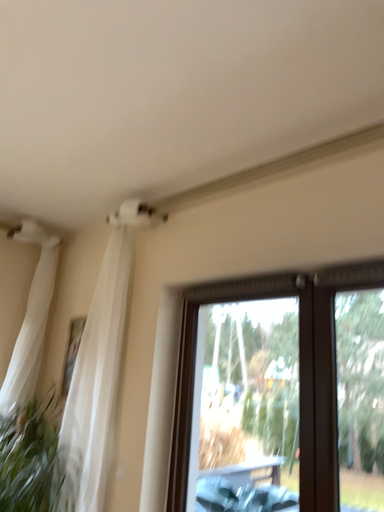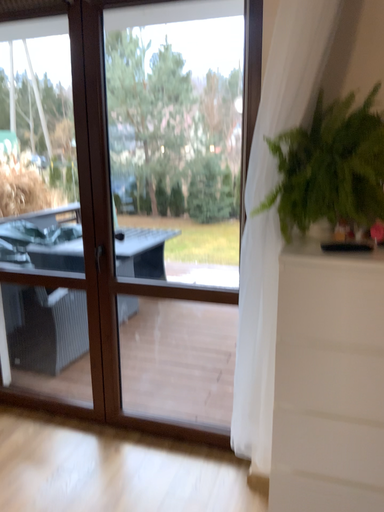
Question: Which way did the camera rotate in the video?

Choices:
 (A) rotated downward
 (B) rotated upward

Answer: (A)